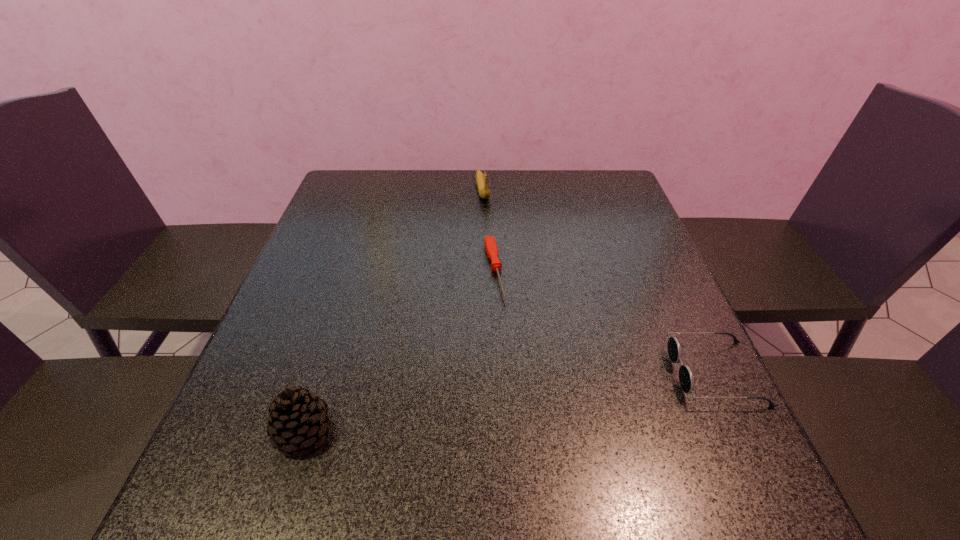
Image resolution: width=960 pixels, height=540 pixels. Identify the location of object that is the third nearest to the farthest object. (298, 419).